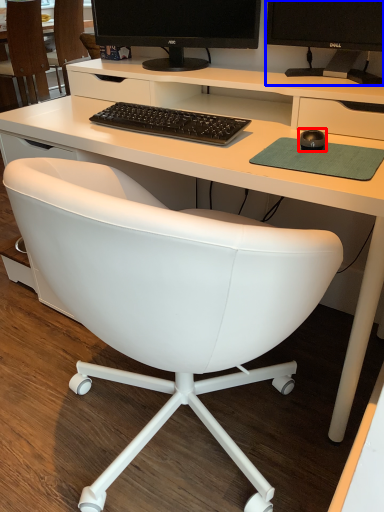
Question: Which of the following is the farthest to the observer, mouse (highlighted by a red box) or television (highlighted by a blue box)?

Choices:
 (A) mouse
 (B) television

Answer: (B)